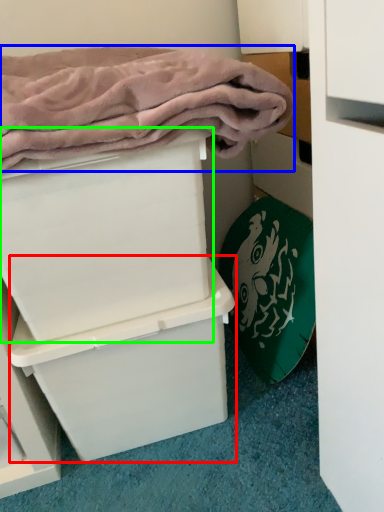
Question: Estimate the real-world distances between objects in this image. Which object is closer to box (highlighted by a red box), bath towel (highlighted by a blue box) or box (highlighted by a green box)?

Choices:
 (A) bath towel
 (B) box

Answer: (B)